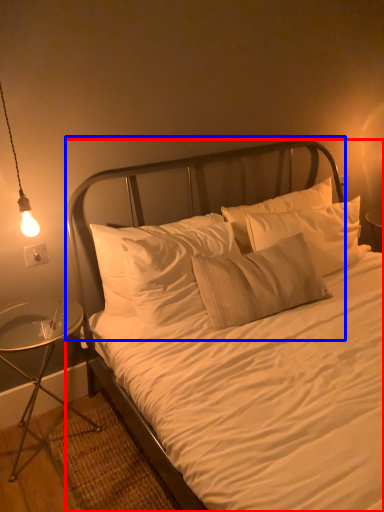
Question: Among these objects, which one is farthest to the camera, bed (highlighted by a red box) or headboard (highlighted by a blue box)?

Choices:
 (A) bed
 (B) headboard

Answer: (B)